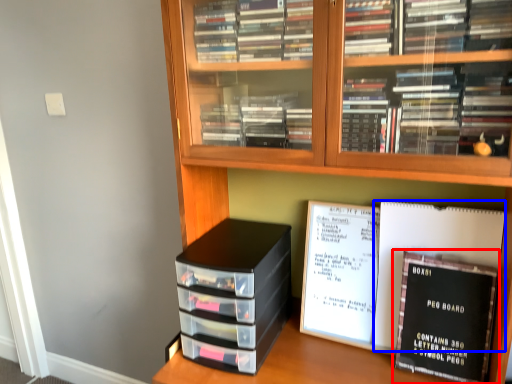
Question: Among these objects, which one is farthest to the camera, book (highlighted by a red box) or journal (highlighted by a blue box)?

Choices:
 (A) book
 (B) journal

Answer: (B)